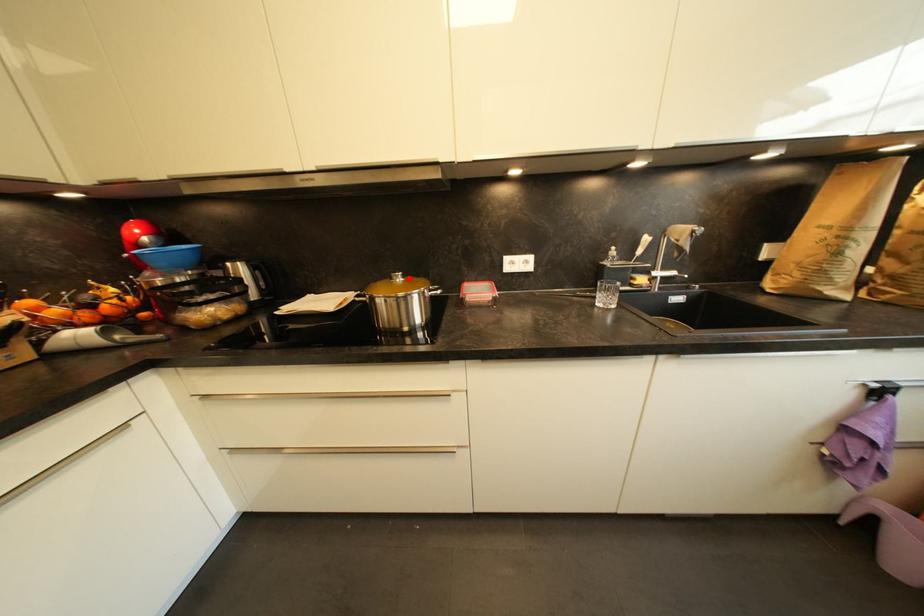
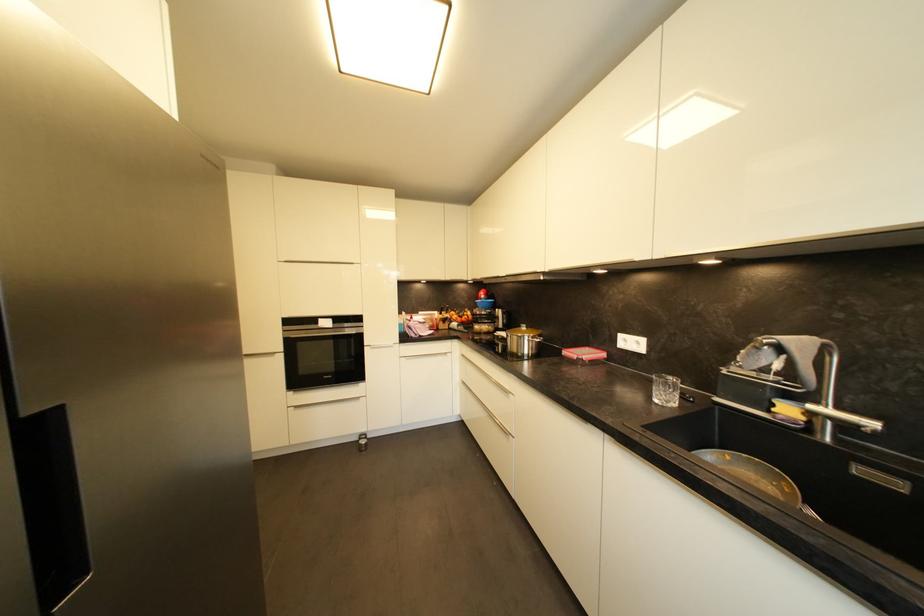
Where in the second image is the point corresponding to the highlighted location from the first image?

(531, 330)